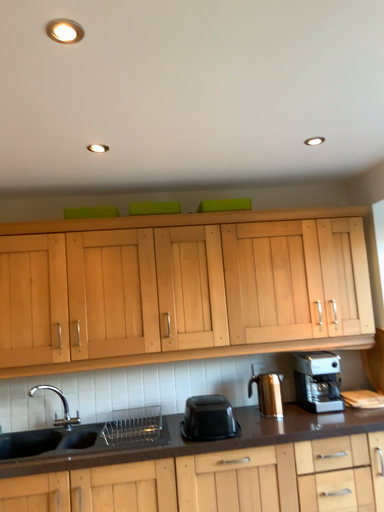
Question: Does shiny metallic coffee maker at right have a lesser width compared to black matte sink at lower left?

Choices:
 (A) yes
 (B) no

Answer: (A)

Question: Is shiny metallic coffee maker at right positioned before black matte sink at lower left?

Choices:
 (A) yes
 (B) no

Answer: (B)

Question: Can black matte sink at lower left be found inside shiny metallic coffee maker at right?

Choices:
 (A) no
 (B) yes

Answer: (A)

Question: From a real-world perspective, is shiny metallic coffee maker at right physically below black matte sink at lower left?

Choices:
 (A) yes
 (B) no

Answer: (B)

Question: Is shiny metallic coffee maker at right not near black matte sink at lower left?

Choices:
 (A) yes
 (B) no

Answer: (B)

Question: Is shiny metallic coffee maker at right bigger or smaller than silver metallic coffee maker at lower right?

Choices:
 (A) small
 (B) big

Answer: (A)

Question: Considering the relative positions of shiny metallic coffee maker at right and silver metallic coffee maker at lower right in the image provided, is shiny metallic coffee maker at right to the left or to the right of silver metallic coffee maker at lower right?

Choices:
 (A) right
 (B) left

Answer: (B)

Question: Is point (261, 375) closer or farther from the camera than point (317, 365)?

Choices:
 (A) closer
 (B) farther

Answer: (A)

Question: Is shiny metallic coffee maker at right taller or shorter than silver metallic coffee maker at lower right?

Choices:
 (A) tall
 (B) short

Answer: (B)

Question: From the image's perspective, is black matte sink at lower left above or below silver metallic coffee maker at lower right?

Choices:
 (A) below
 (B) above

Answer: (A)

Question: From a real-world perspective, is black matte sink at lower left above or below silver metallic coffee maker at lower right?

Choices:
 (A) above
 (B) below

Answer: (B)

Question: Considering the positions of point (130, 422) and point (311, 392), is point (130, 422) closer or farther from the camera than point (311, 392)?

Choices:
 (A) farther
 (B) closer

Answer: (A)

Question: Considering the positions of black matte sink at lower left and silver metallic coffee maker at lower right in the image, is black matte sink at lower left taller or shorter than silver metallic coffee maker at lower right?

Choices:
 (A) tall
 (B) short

Answer: (A)

Question: Looking at the image, does silver metallic coffee maker at lower right seem bigger or smaller compared to black matte sink at lower left?

Choices:
 (A) small
 (B) big

Answer: (A)

Question: From the image's perspective, relative to black matte sink at lower left, is silver metallic coffee maker at lower right above or below?

Choices:
 (A) below
 (B) above

Answer: (B)